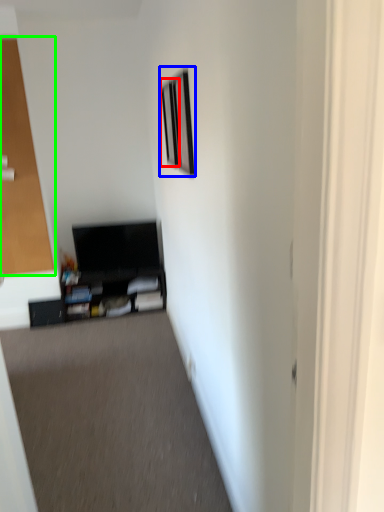
Question: Which object is positioned farthest from picture frame (highlighted by a red box)? Select from picture frame (highlighted by a blue box) and glass door (highlighted by a green box).

Choices:
 (A) picture frame
 (B) glass door

Answer: (B)